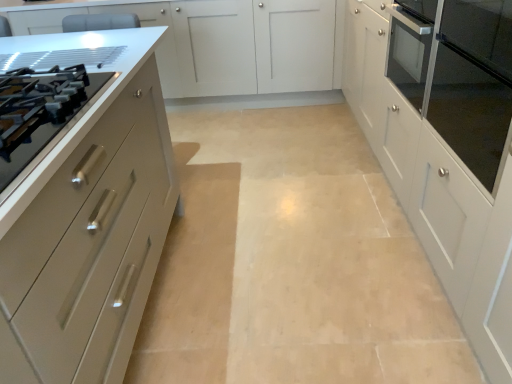
What do you see at coordinates (463, 76) in the screenshot?
I see `matte glass oven door at right` at bounding box center [463, 76].

Locate an element on the screen. matte white cabinet at center, the second cabinetry positioned from the left is located at coordinates (227, 42).

This screenshot has height=384, width=512. I want to click on white glossy cabinet at right, the 1th cabinetry when ordered from right to left, so click(x=445, y=144).

Considering the relative positions of white glossy cabinet at right, the 1th cabinetry when ordered from right to left, and matte glass oven door at right in the image provided, is white glossy cabinet at right, the 1th cabinetry when ordered from right to left, to the right of matte glass oven door at right from the viewer's perspective?

Yes, white glossy cabinet at right, the 1th cabinetry when ordered from right to left, is to the right of matte glass oven door at right.

From a real-world perspective, which is physically below, white glossy cabinet at right, placed as the third cabinetry when sorted from left to right, or matte glass oven door at right?

From a 3D spatial view, white glossy cabinet at right, placed as the third cabinetry when sorted from left to right, is below.

Looking at this image, is the depth of white glossy cabinet at right, placed as the third cabinetry when sorted from left to right, greater than that of matte glass oven door at right?

No, white glossy cabinet at right, placed as the third cabinetry when sorted from left to right, is closer to the camera.

How much distance is there between white glossy cabinet at right, placed as the third cabinetry when sorted from left to right, and matte glass oven door at right?

The distance of white glossy cabinet at right, placed as the third cabinetry when sorted from left to right, from matte glass oven door at right is 5.20 inches.

Can you tell me how much matte beige cabinet at left, acting as the first cabinetry starting from the left, and white glossy cabinet at right, placed as the third cabinetry when sorted from left to right, differ in facing direction?

180 degrees separate the facing orientations of matte beige cabinet at left, acting as the first cabinetry starting from the left, and white glossy cabinet at right, placed as the third cabinetry when sorted from left to right.

Is matte beige cabinet at left, acting as the first cabinetry starting from the left, touching white glossy cabinet at right, the 1th cabinetry when ordered from right to left?

No, matte beige cabinet at left, acting as the first cabinetry starting from the left, is not beside white glossy cabinet at right, the 1th cabinetry when ordered from right to left.

Can you confirm if matte beige cabinet at left, acting as the first cabinetry starting from the left, is wider than white glossy cabinet at right, the 1th cabinetry when ordered from right to left?

Yes, matte beige cabinet at left, acting as the first cabinetry starting from the left, is wider than white glossy cabinet at right, the 1th cabinetry when ordered from right to left.

Which is farther, [486,99] or [488,12]?

The point [486,99] is farther.

From a real-world perspective, is matte glass oven door at right physically located above or below white glossy cabinet at right, the 1th cabinetry when ordered from right to left?

In terms of real-world spatial position, matte glass oven door at right is above white glossy cabinet at right, the 1th cabinetry when ordered from right to left.

Is matte glass oven door at right with white glossy cabinet at right, placed as the third cabinetry when sorted from left to right?

No.

Looking at this image, does matte glass oven door at right turn towards white glossy cabinet at right, placed as the third cabinetry when sorted from left to right?

Yes, matte glass oven door at right is oriented towards white glossy cabinet at right, placed as the third cabinetry when sorted from left to right.

Is satin silver drawer at left oriented away from matte beige cabinet at left, acting as the third cabinetry starting from the right?

No.

From the picture: Which of these two, satin silver drawer at left or matte beige cabinet at left, acting as the first cabinetry starting from the left, stands taller?

matte beige cabinet at left, acting as the first cabinetry starting from the left, is taller.

Looking at the image, does satin silver drawer at left seem bigger or smaller compared to matte beige cabinet at left, acting as the first cabinetry starting from the left?

Considering their sizes, satin silver drawer at left takes up less space than matte beige cabinet at left, acting as the first cabinetry starting from the left.

Which is more to the right, satin silver drawer at left or matte beige cabinet at left, acting as the third cabinetry starting from the right?

Positioned to the right is satin silver drawer at left.

Based on the photo, considering the relative sizes of matte beige cabinet at left, acting as the first cabinetry starting from the left, and matte white cabinet at center, the second cabinetry positioned from the left, in the image provided, is matte beige cabinet at left, acting as the first cabinetry starting from the left, thinner than matte white cabinet at center, the second cabinetry positioned from the left,?

No, matte beige cabinet at left, acting as the first cabinetry starting from the left, is not thinner than matte white cabinet at center, the second cabinetry positioned from the left.

Who is taller, matte beige cabinet at left, acting as the first cabinetry starting from the left, or matte white cabinet at center, which is the second cabinetry from right to left?

matte white cabinet at center, which is the second cabinetry from right to left, is taller.

From a real-world perspective, is matte beige cabinet at left, acting as the third cabinetry starting from the right, on top of matte white cabinet at center, which is the second cabinetry from right to left?

No.

Which object is more forward, matte beige cabinet at left, acting as the first cabinetry starting from the left, or matte white cabinet at center, the second cabinetry positioned from the left?

matte beige cabinet at left, acting as the first cabinetry starting from the left, is in front.

This screenshot has height=384, width=512. In order to click on home appliance that appears above the matte beige cabinet at left, acting as the first cabinetry starting from the left (from a real-world perspective) in this screenshot , I will do `click(463, 76)`.

Between matte glass oven door at right and matte beige cabinet at left, acting as the third cabinetry starting from the right, which one has less height?

matte glass oven door at right is shorter.

Is matte glass oven door at right wider or thinner than matte beige cabinet at left, acting as the third cabinetry starting from the right?

Considering their sizes, matte glass oven door at right looks slimmer than matte beige cabinet at left, acting as the third cabinetry starting from the right.

In the scene shown: From a real-world perspective, which is physically below, matte glass oven door at right or matte beige cabinet at left, acting as the first cabinetry starting from the left?

From a 3D spatial view, matte beige cabinet at left, acting as the first cabinetry starting from the left, is below.

Is matte glass oven door at right at the left side of satin silver drawer at left?

Incorrect, matte glass oven door at right is not on the left side of satin silver drawer at left.

Is matte glass oven door at right shorter than satin silver drawer at left?

No.

Is matte glass oven door at right with satin silver drawer at left?

No, matte glass oven door at right is not in contact with satin silver drawer at left.

From a real-world perspective, who is located lower, matte glass oven door at right or satin silver drawer at left?

matte glass oven door at right is physically lower.

Where is `home appliance located behind the white glossy cabinet at right, placed as the third cabinetry when sorted from left to right`? The width and height of the screenshot is (512, 384). home appliance located behind the white glossy cabinet at right, placed as the third cabinetry when sorted from left to right is located at coordinates (463, 76).

In the image, there is a white glossy cabinet at right, the 1th cabinetry when ordered from right to left. Identify the location of cabinetry below it (from the image's perspective). (93, 243).

Looking at the image, which one is located closer to white glossy cabinet at right, placed as the third cabinetry when sorted from left to right, matte white cabinet at center, the second cabinetry positioned from the left, or matte glass oven door at right?

matte glass oven door at right is positioned closer to the anchor white glossy cabinet at right, placed as the third cabinetry when sorted from left to right.

Based on their spatial positions, is matte beige cabinet at left, acting as the third cabinetry starting from the right, or white glossy cabinet at right, placed as the third cabinetry when sorted from left to right, further from satin silver drawer at left?

white glossy cabinet at right, placed as the third cabinetry when sorted from left to right, lies further to satin silver drawer at left than the other object.

Estimate the real-world distances between objects in this image. Which object is closer to white glossy cabinet at right, placed as the third cabinetry when sorted from left to right, matte glass oven door at right or matte beige cabinet at left, acting as the first cabinetry starting from the left?

Based on the image, matte glass oven door at right appears to be nearer to white glossy cabinet at right, placed as the third cabinetry when sorted from left to right.

Based on their spatial positions, is matte beige cabinet at left, acting as the first cabinetry starting from the left, or white glossy cabinet at right, placed as the third cabinetry when sorted from left to right, closer to matte white cabinet at center, which is the second cabinetry from right to left?

Based on the image, white glossy cabinet at right, placed as the third cabinetry when sorted from left to right, appears to be nearer to matte white cabinet at center, which is the second cabinetry from right to left.

Which object lies nearer to the anchor point matte beige cabinet at left, acting as the first cabinetry starting from the left, matte glass oven door at right or satin silver drawer at left?

satin silver drawer at left is closer to matte beige cabinet at left, acting as the first cabinetry starting from the left.

From the image, which object appears to be farther from matte beige cabinet at left, acting as the third cabinetry starting from the right, satin silver drawer at left or white glossy cabinet at right, placed as the third cabinetry when sorted from left to right?

Based on the image, white glossy cabinet at right, placed as the third cabinetry when sorted from left to right, appears to be further to matte beige cabinet at left, acting as the third cabinetry starting from the right.

Considering their positions, is matte beige cabinet at left, acting as the third cabinetry starting from the right, positioned further to matte glass oven door at right than white glossy cabinet at right, the 1th cabinetry when ordered from right to left?

matte beige cabinet at left, acting as the third cabinetry starting from the right, is positioned further to the anchor matte glass oven door at right.

Estimate the real-world distances between objects in this image. Which object is closer to satin silver drawer at left, matte beige cabinet at left, acting as the first cabinetry starting from the left, or matte glass oven door at right?

matte beige cabinet at left, acting as the first cabinetry starting from the left, is positioned closer to the anchor satin silver drawer at left.

Locate an element on the screen. This screenshot has width=512, height=384. home appliance between satin silver drawer at left and matte white cabinet at center, which is the second cabinetry from right to left, along the z-axis is located at coordinates (463, 76).

Locate an element on the screen. This screenshot has width=512, height=384. cabinetry between matte beige cabinet at left, acting as the third cabinetry starting from the right, and matte white cabinet at center, which is the second cabinetry from right to left, in the front-back direction is located at coordinates (445, 144).

In order to click on drawer located between white glossy cabinet at right, placed as the third cabinetry when sorted from left to right, and matte white cabinet at center, which is the second cabinetry from right to left, in the depth direction in this screenshot , I will do `click(39, 111)`.

Identify the location of home appliance between satin silver drawer at left and white glossy cabinet at right, placed as the third cabinetry when sorted from left to right, in the horizontal direction. This screenshot has height=384, width=512. (463, 76).